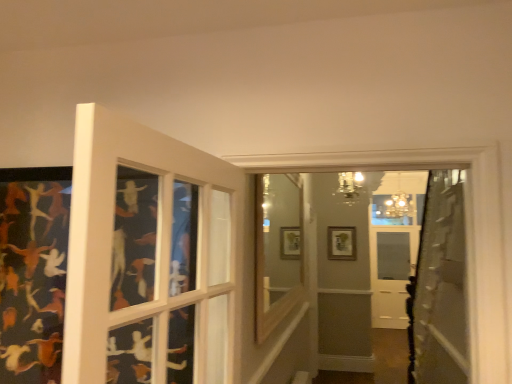
Question: Is point (327, 236) closer or farther from the camera than point (408, 206)?

Choices:
 (A) farther
 (B) closer

Answer: (B)

Question: In terms of width, does wooden picture frame at center look wider or thinner when compared to matte gold chandelier at upper center, which ranks as the 2th light fixture in left-to-right order?

Choices:
 (A) thin
 (B) wide

Answer: (A)

Question: Considering the real-world distances, which object is farthest from the metallic chandelier at upper center, the 1th light fixture when ordered from front to back?

Choices:
 (A) wooden window frame at center
 (B) wooden picture frame at center
 (C) matte gold chandelier at upper center, the first light fixture from the right

Answer: (C)

Question: Which of these objects is positioned closest to the matte gold chandelier at upper center, which is the 2th light fixture from front to back?

Choices:
 (A) wooden picture frame at center
 (B) metallic chandelier at upper center, which is the second light fixture in right-to-left order
 (C) wooden window frame at center

Answer: (A)